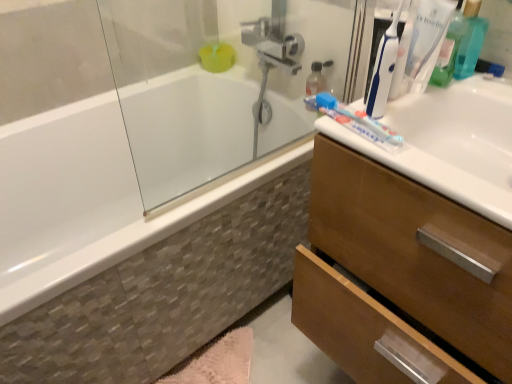
Locate an element on the screen. empty space that is ontop of pink fluffy bath mat at lower center (from a real-world perspective) is located at coordinates (239, 365).